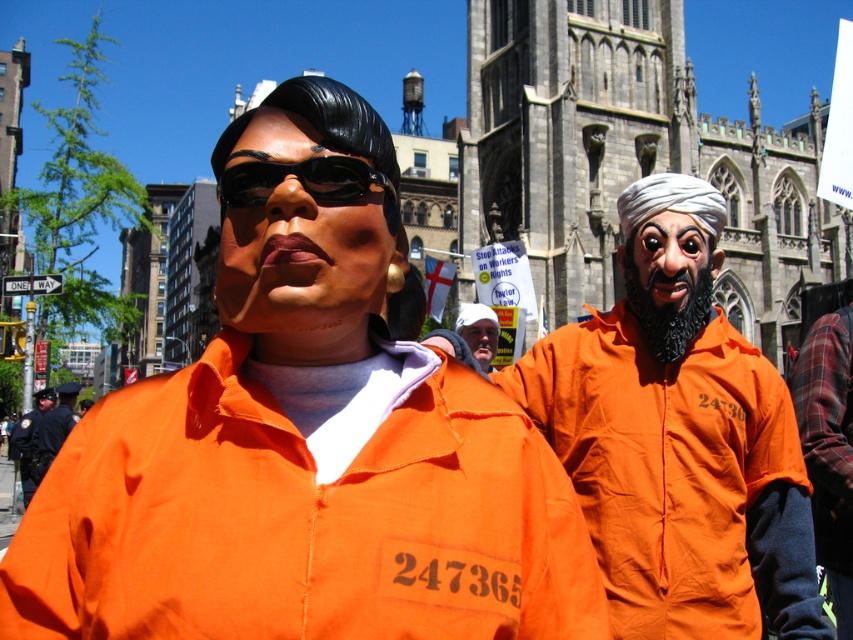
You are a photographer trying to capture the smooth orange mask at center and the white cap at center in a single shot. Which object should you focus on first to ensure both are in focus?

You should focus on the smooth orange mask at center first because it is closer to the viewer than the white cap at center, allowing the depth of field to cover both objects.